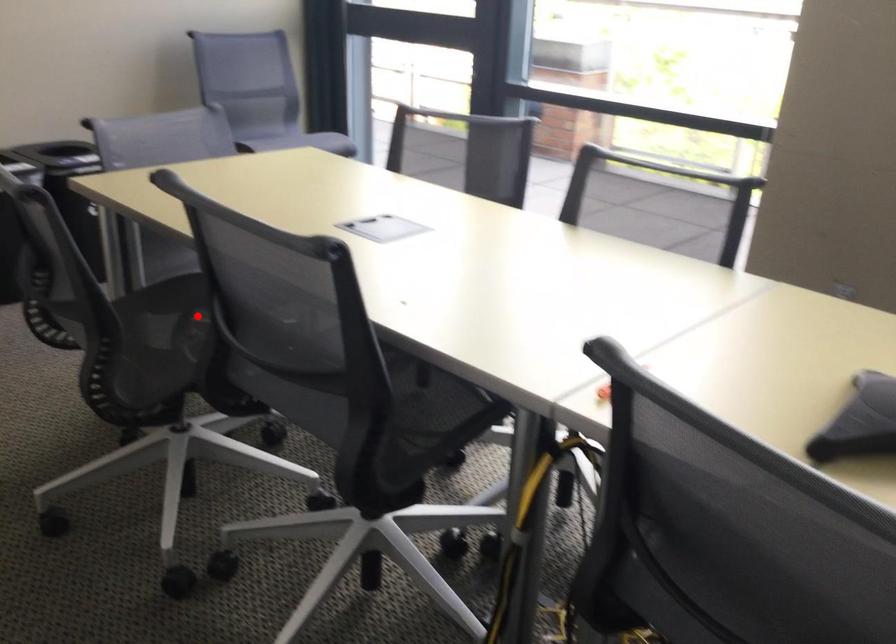
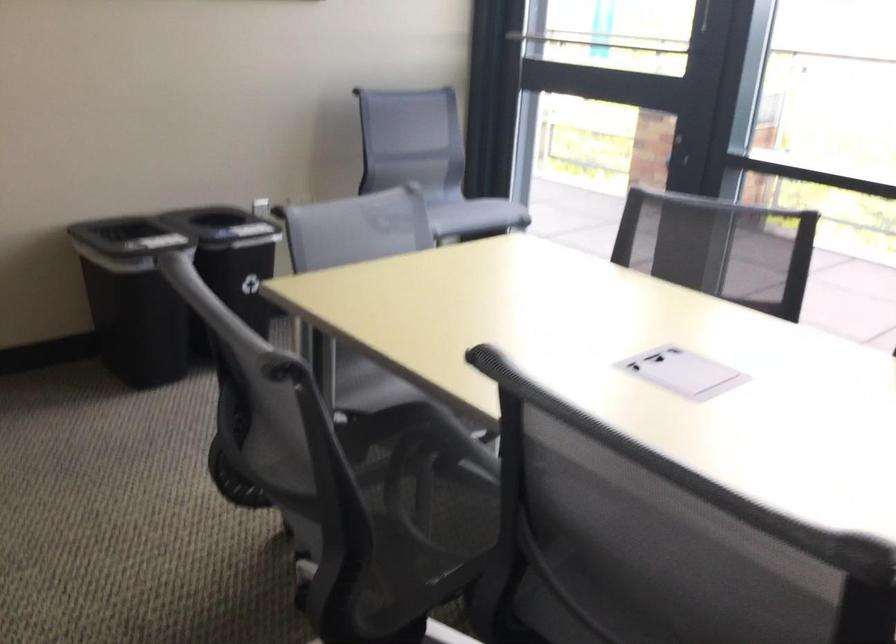
Find the pixel in the second image that matches the highlighted location in the first image.

(421, 480)